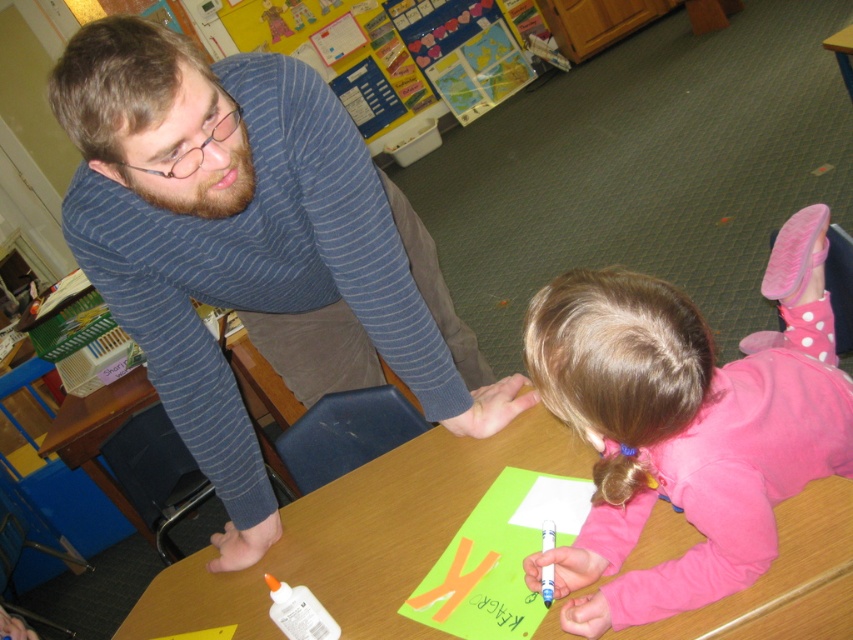
Question: Which of the following is the closest to the observer?

Choices:
 (A) blue striped sweater at upper left
 (B) wooden table at center
 (C) pink fleece shirt at lower right

Answer: (C)

Question: Does blue striped sweater at upper left have a smaller size compared to pink fleece shirt at lower right?

Choices:
 (A) yes
 (B) no

Answer: (B)

Question: Which point is farther to the camera?

Choices:
 (A) (593, 518)
 (B) (799, 636)
 (C) (80, 198)

Answer: (C)

Question: Can you confirm if blue striped sweater at upper left is positioned to the right of wooden table at center?

Choices:
 (A) no
 (B) yes

Answer: (A)

Question: Which object is the farthest from the pink fleece shirt at lower right?

Choices:
 (A) wooden table at center
 (B) blue striped sweater at upper left

Answer: (B)

Question: Observing the image, what is the correct spatial positioning of pink fleece shirt at lower right in reference to wooden table at center?

Choices:
 (A) above
 (B) below

Answer: (A)